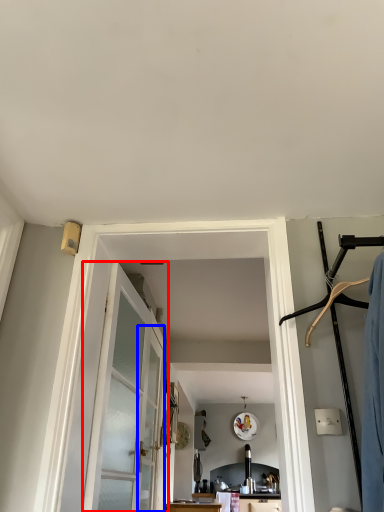
Question: Which of the following is the farthest to the observer, door (highlighted by a red box) or screen door (highlighted by a blue box)?

Choices:
 (A) door
 (B) screen door

Answer: (B)